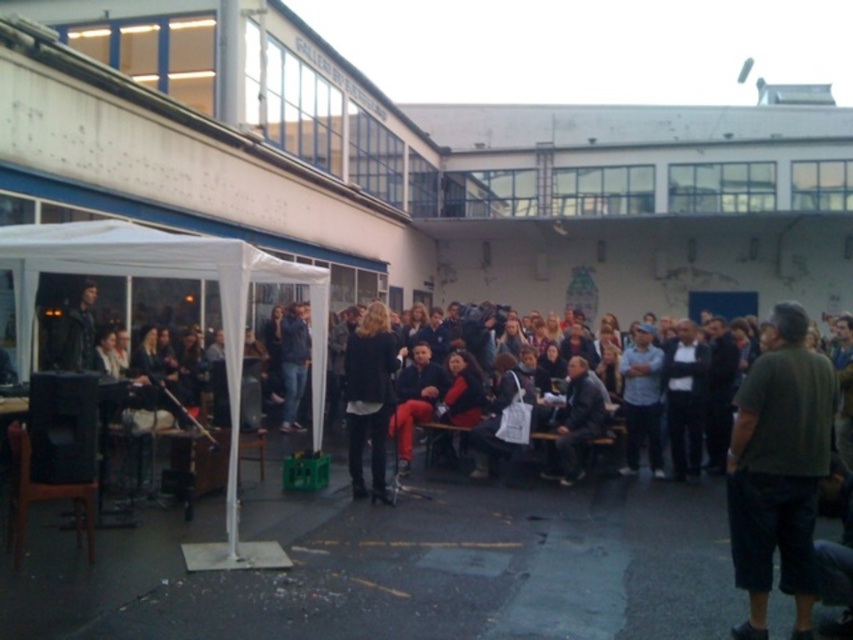
You are standing in the courtyard and see the dark green shirt at right and the white fabric canopy at left. Which object is positioned lower in the image?

The dark green shirt at right is below the white fabric canopy at left, so it is positioned lower in the image.

You are standing in the courtyard and want to take a photo of the matte gray shirt at center without the white fabric canopy at left blocking the view. Is the canopy too tall to block the shirt?

The white fabric canopy at left is shorter than the matte gray shirt at center, so it won not block the view of the matte gray shirt at center.

You are attending an event in the courtyard and notice two people wearing similar shades of gray. The first person is wearing a matte gray shirt at center, and the second is wearing a dark gray suit at center. From your perspective, which person is standing in front of the other?

The matte gray shirt at center is positioned over dark gray suit at center, so the person wearing the matte gray shirt at center is standing in front of the person in the dark gray suit at center.